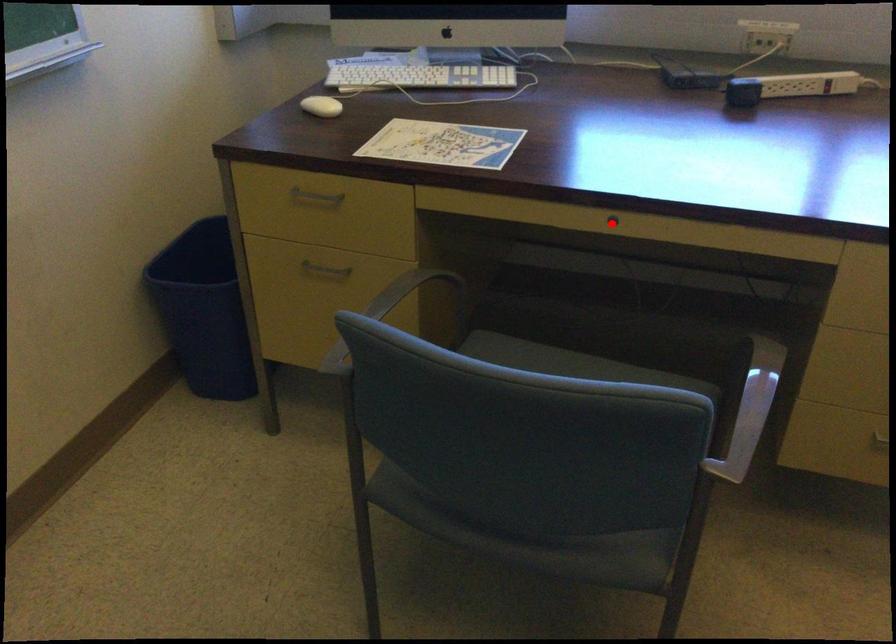
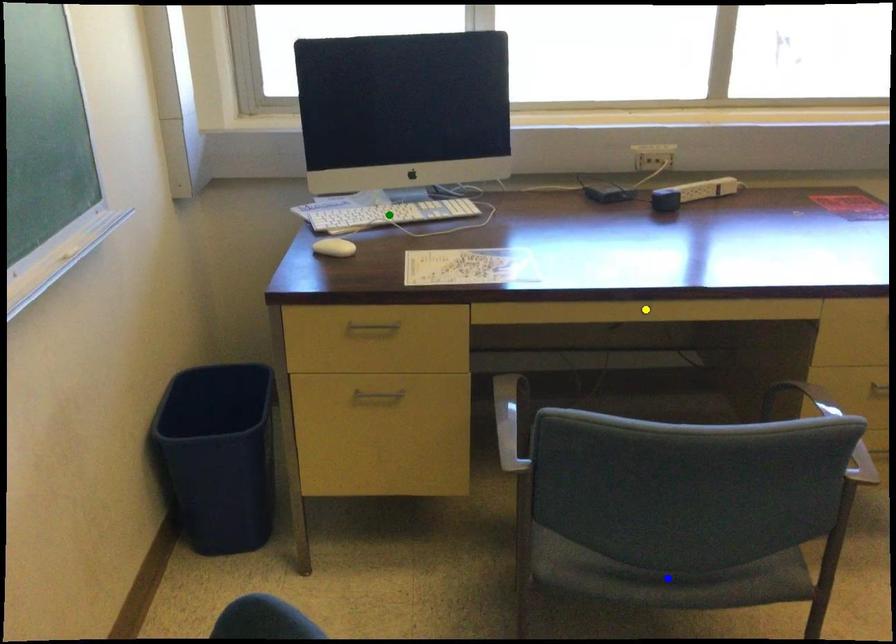
Question: I am providing you with two images of the same scene from different viewpoints. A red point is marked on the first image. You are given multiple points on the second image. Can you choose the point in image 2 that corresponds to the point in image 1?

Choices:
 (A) green point
 (B) blue point
 (C) yellow point

Answer: (C)